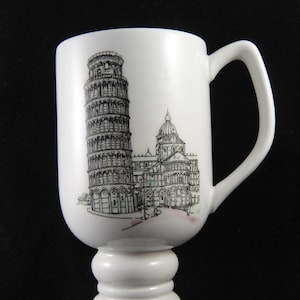
Locate an element on the screen. Image resolution: width=300 pixels, height=300 pixels. handle is located at coordinates (272, 124).